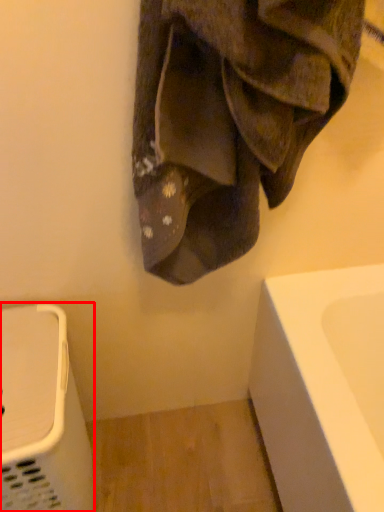
Question: From the image's perspective, what is the correct spatial positioning of appliance (annotated by the red box) in reference to towel?

Choices:
 (A) below
 (B) above

Answer: (A)